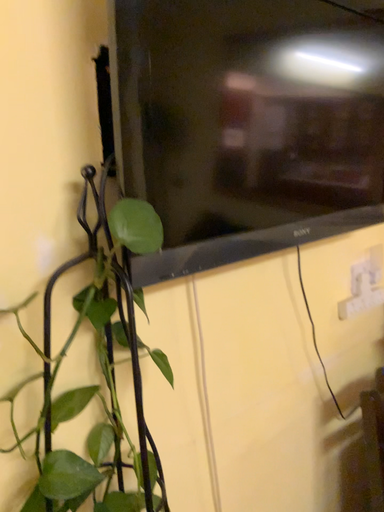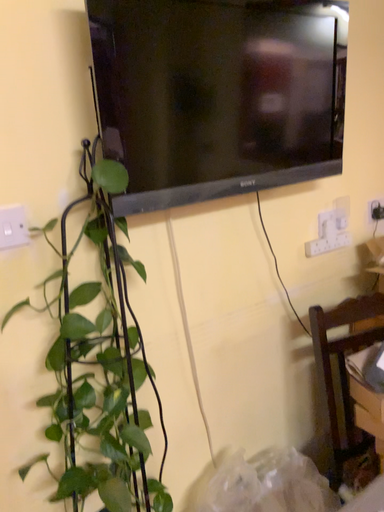
Question: Which way did the camera rotate in the video?

Choices:
 (A) rotated right
 (B) rotated left

Answer: (B)